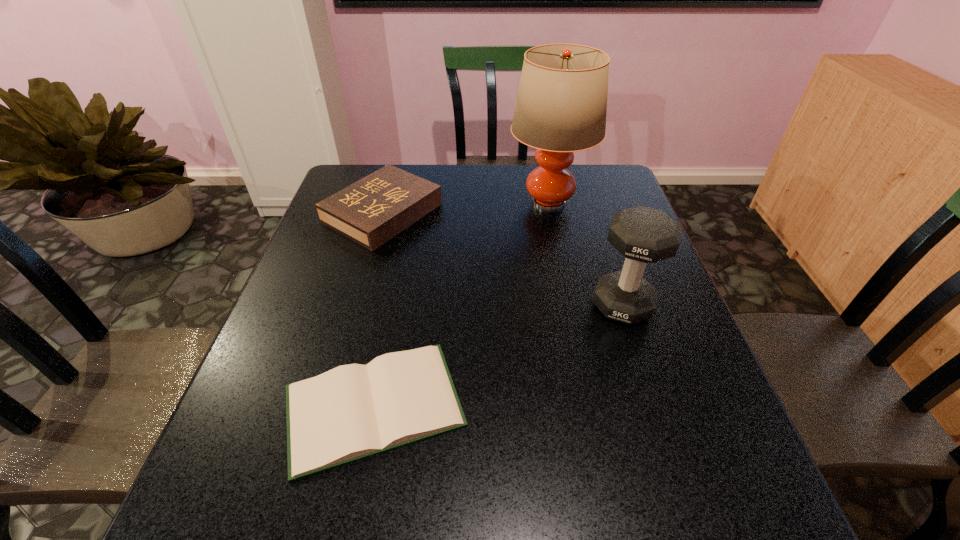
This screenshot has width=960, height=540. In order to click on vacant space located 0.170m on the back of the shorter hardback book in this screenshot , I will do `click(396, 290)`.

Identify the location of lamp that is at the far edge. (561, 105).

Find the location of a particular element. Image resolution: width=960 pixels, height=540 pixels. hardback book present at the far edge is located at coordinates pyautogui.click(x=371, y=211).

Locate an element on the screen. object that is at the near edge is located at coordinates (352, 412).

Where is `lamp that is at the right edge`? This screenshot has width=960, height=540. lamp that is at the right edge is located at coordinates (561, 105).

I want to click on dumbbell at the right edge, so click(x=643, y=235).

At what (x,y) coordinates should I click in order to perform the action: click on object that is at the far left corner. Please return your answer as a coordinate pair (x, y). The height and width of the screenshot is (540, 960). Looking at the image, I should click on (371, 211).

Identify the location of object located in the near left corner section of the desktop. (352, 412).

This screenshot has height=540, width=960. Identify the location of object at the far right corner. (561, 105).

Locate an element on the screen. blank space at the far edge is located at coordinates 456,198.